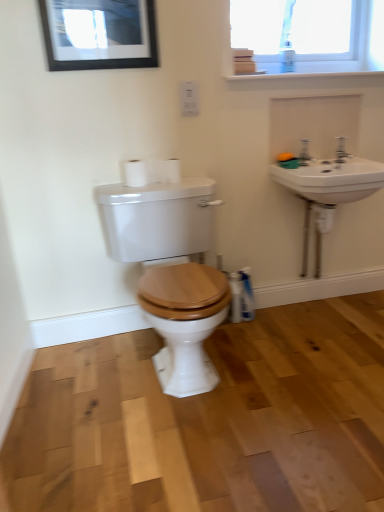
Question: Is white matte toilet paper at upper center, the first toilet paper in the right-to-left sequence, in front of or behind white plastic bottle at lower right in the image?

Choices:
 (A) front
 (B) behind

Answer: (A)

Question: Is point (x=170, y=163) closer or farther from the camera than point (x=248, y=276)?

Choices:
 (A) closer
 (B) farther

Answer: (A)

Question: Which of these objects is positioned farthest from the white matte toilet paper at upper center, which appears as the 2th toilet paper when viewed from the right?

Choices:
 (A) white ceramic sink at upper right
 (B) white ceramic sink at upper right
 (C) white plastic bottle at lower right
 (D) white matte toilet paper at upper center, the second toilet paper from the left
 (E) wooden toilet seat at center

Answer: (A)

Question: Which object is the closest to the wooden toilet seat at center?

Choices:
 (A) white ceramic sink at upper right
 (B) white matte toilet paper at upper center, which appears as the first toilet paper when viewed from the left
 (C) silver metallic faucet at upper right
 (D) clear glass window at upper right
 (E) orange matte soap at upper right

Answer: (B)